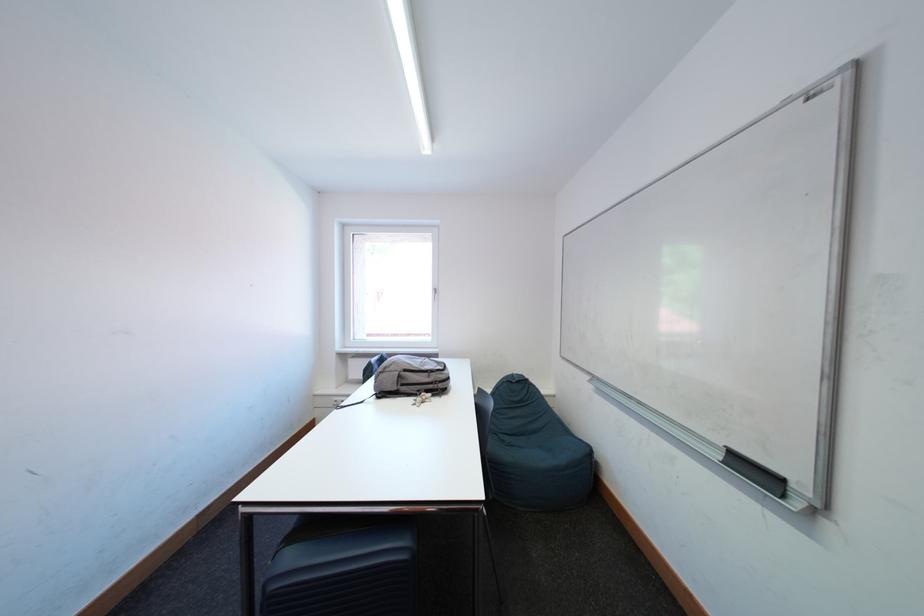
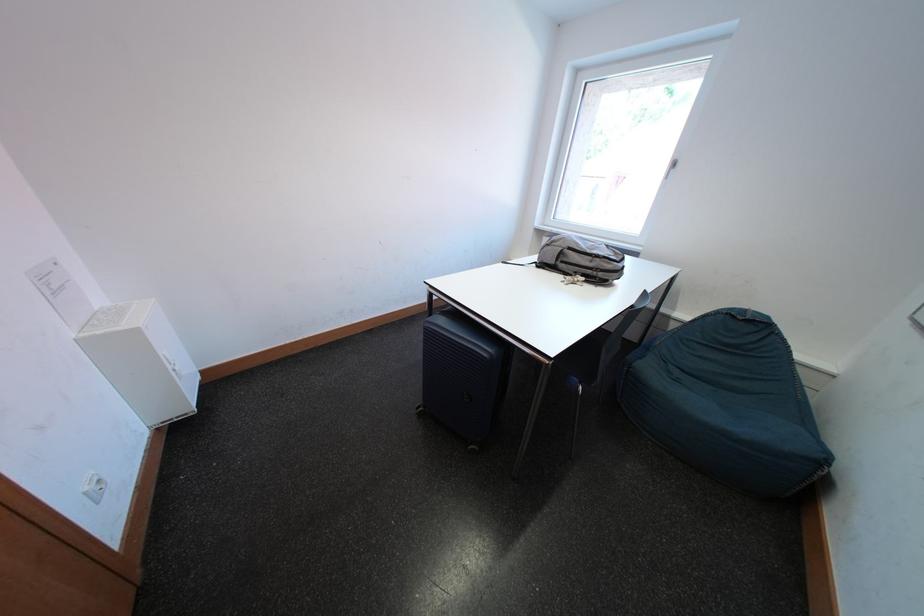
Consider the image. How did the camera likely rotate?

The camera's rotation is toward left-down.